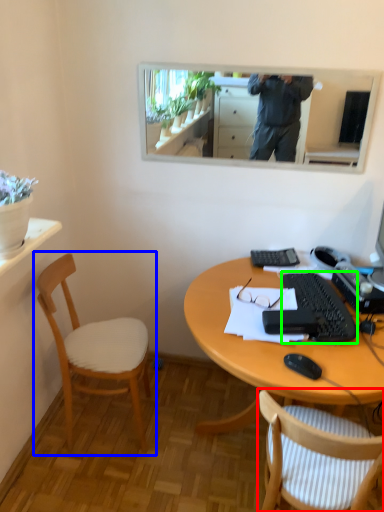
Question: Based on their relative distances, which object is nearer to chair (highlighted by a red box)? Choose from chair (highlighted by a blue box) and keyboard (highlighted by a green box).

Choices:
 (A) chair
 (B) keyboard

Answer: (B)